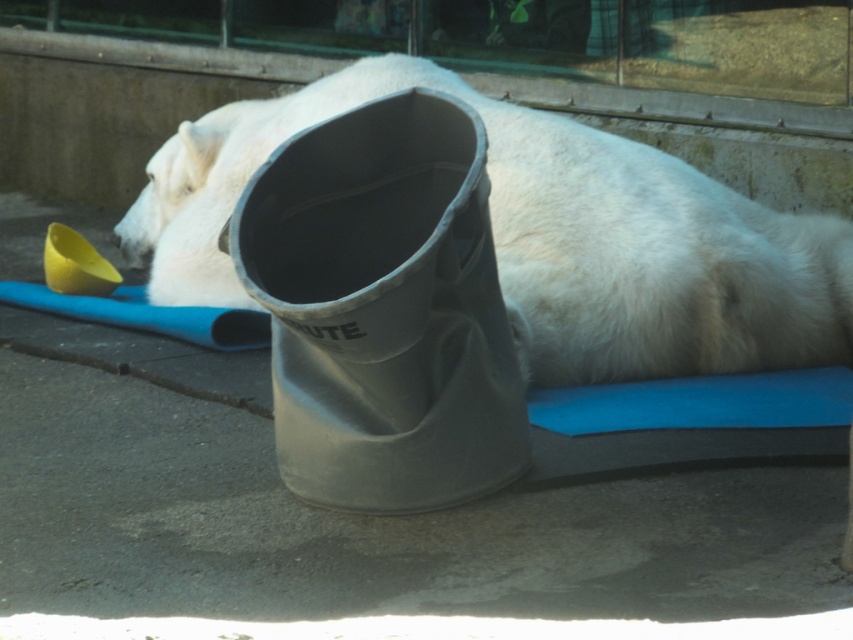
Can you confirm if white matte polar bear at center is taller than matte gray boot at center?

Indeed, white matte polar bear at center has a greater height compared to matte gray boot at center.

You are a GUI agent. You are given a task and a screenshot of the screen. Output one action in this format:
    pyautogui.click(x=<x>, y=<y>)
    Task: Click on the white matte polar bear at center
    The width and height of the screenshot is (853, 640).
    Given the screenshot: What is the action you would take?
    pyautogui.click(x=543, y=237)

Locate an element on the screen. white matte polar bear at center is located at coordinates (543, 237).